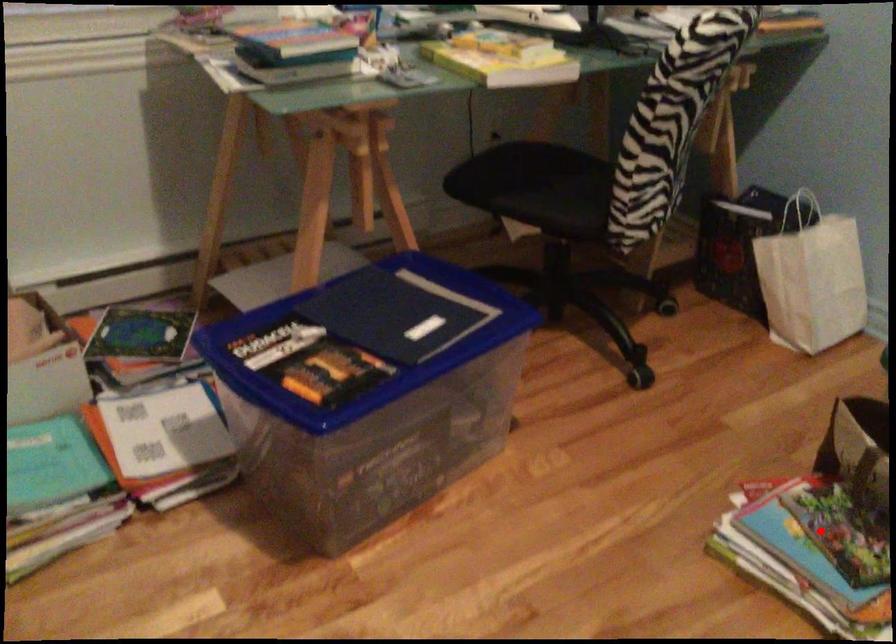
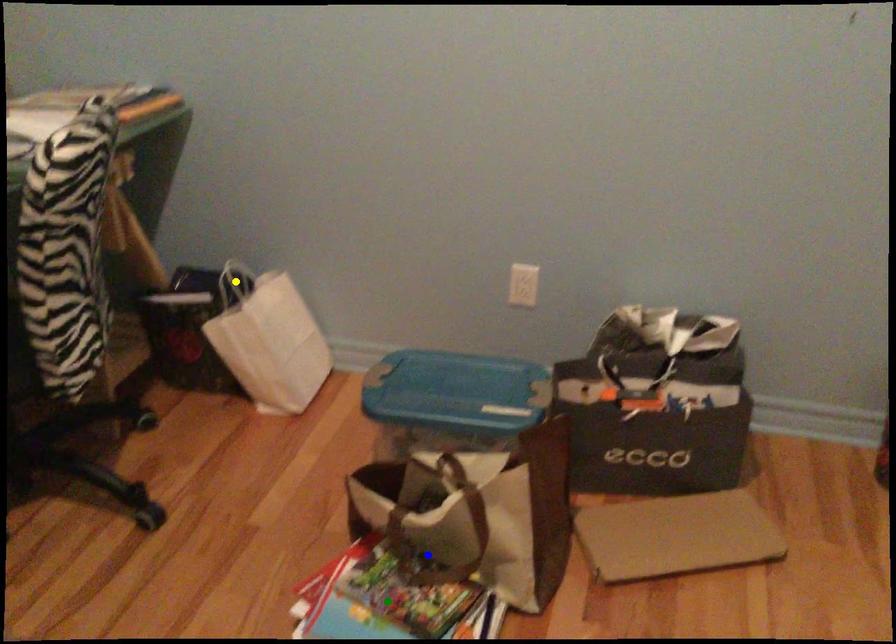
Question: I am providing you with two images of the same scene from different viewpoints. A red point is marked on the first image. You are given multiple points on the second image. Can you choose the point in image 2 that corresponds to the point in image 1?

Choices:
 (A) green point
 (B) yellow point
 (C) blue point

Answer: (A)